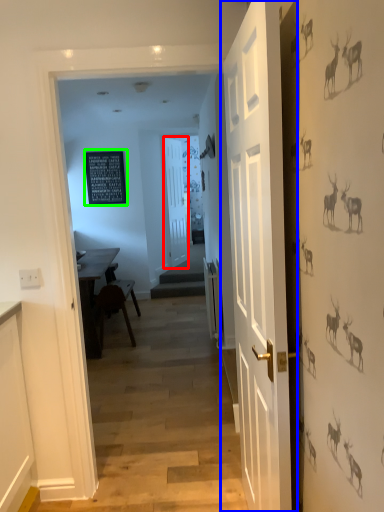
Question: Which object is the closest to the door (highlighted by a red box)? Choose among these: door (highlighted by a blue box) or bulletin board (highlighted by a green box).

Choices:
 (A) door
 (B) bulletin board

Answer: (B)